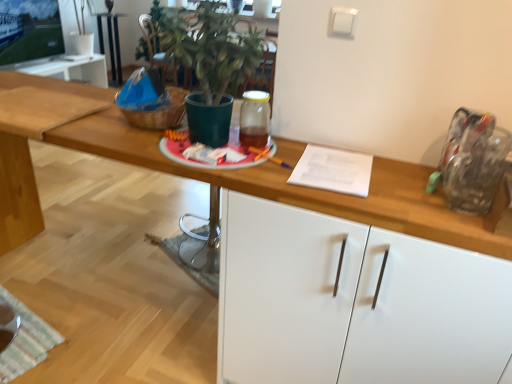
Question: From the image's perspective, is metallic silver table at center above or below green matte plant pot at center?

Choices:
 (A) above
 (B) below

Answer: (A)

Question: Looking at their shapes, would you say metallic silver table at center is wider or thinner than green matte plant pot at center?

Choices:
 (A) thin
 (B) wide

Answer: (A)

Question: Which is nearer to the metallic silver table at center?

Choices:
 (A) white glossy cabinet at center
 (B) green matte plant pot at center

Answer: (B)

Question: Considering the real-world distances, which object is farthest from the green matte plant pot at center?

Choices:
 (A) white glossy cabinet at center
 (B) metallic silver table at center

Answer: (B)